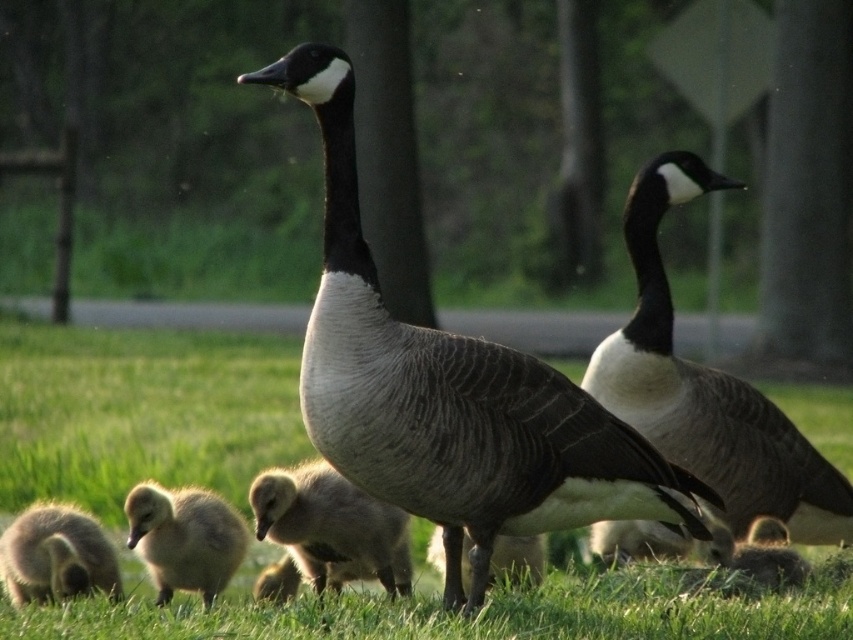
In the scene shown: Can you confirm if green soft grass at center is bigger than soft yellow duckling at lower left?

Yes, green soft grass at center is bigger than soft yellow duckling at lower left.

Between green soft grass at center and soft yellow duckling at lower left, which one appears on the left side from the viewer's perspective?

Positioned to the left is soft yellow duckling at lower left.

Who is more distant from viewer, (48, 481) or (218, 548)?

Point (48, 481)

At what (x,y) coordinates should I click in order to perform the action: click on green soft grass at center. Please return your answer as a coordinate pair (x, y). This screenshot has height=640, width=853. Looking at the image, I should click on (141, 412).

In the scene shown: Does green soft grass at center have a larger size compared to green soft grass at lower center?

Yes, green soft grass at center is bigger than green soft grass at lower center.

Which of these two, green soft grass at center or green soft grass at lower center, stands shorter?

green soft grass at lower center

Does point (622, 624) come closer to viewer compared to point (619, 570)?

Yes.

The width and height of the screenshot is (853, 640). I want to click on green soft grass at center, so click(x=141, y=412).

Measure the distance from green soft grass at center to soft brown duckling at lower right.

A distance of 31.22 inches exists between green soft grass at center and soft brown duckling at lower right.

Consider the image. Between green soft grass at center and soft brown duckling at lower right, which one appears on the left side from the viewer's perspective?

green soft grass at center is more to the left.

In order to click on green soft grass at center in this screenshot , I will do `click(141, 412)`.